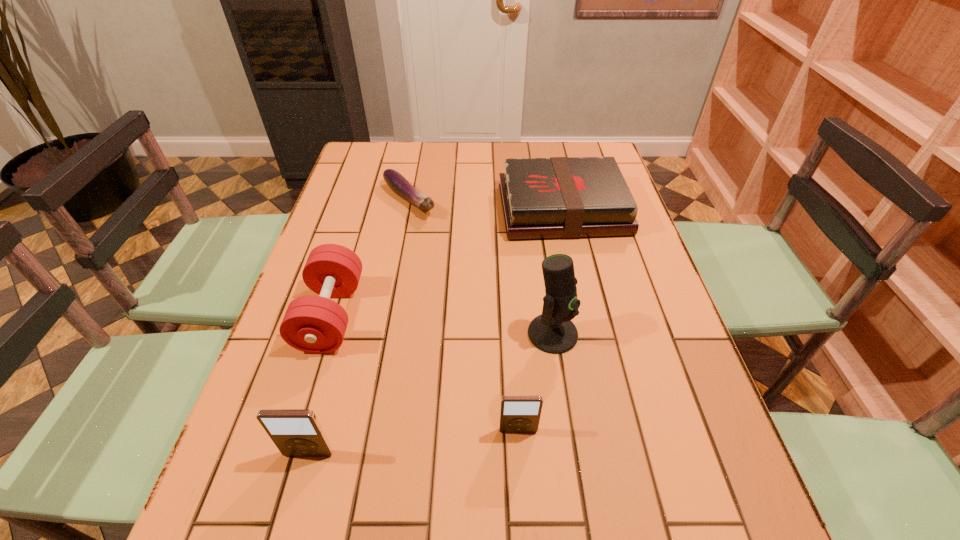
The image size is (960, 540). I want to click on free space located on the front of the eggplant, so click(x=399, y=247).

Locate an element on the screen. The width and height of the screenshot is (960, 540). vacant space located 0.060m on the back of the fifth tallest object is located at coordinates (554, 171).

Where is `vacant area situated 0.220m on the right of the dumbbell`? This screenshot has height=540, width=960. vacant area situated 0.220m on the right of the dumbbell is located at coordinates (452, 315).

Find the location of `iPod positioned at the left edge`. iPod positioned at the left edge is located at coordinates (296, 432).

Where is `eggplant situated at the left edge`? This screenshot has width=960, height=540. eggplant situated at the left edge is located at coordinates (398, 184).

Find the location of a particular element. The height and width of the screenshot is (540, 960). dumbbell that is at the left edge is located at coordinates [313, 324].

At what (x,y) coordinates should I click in order to perform the action: click on object that is at the right edge. Please return your answer as a coordinate pair (x, y). Image resolution: width=960 pixels, height=540 pixels. Looking at the image, I should click on (558, 197).

Where is `object that is at the near left corner`? object that is at the near left corner is located at coordinates (296, 432).

The image size is (960, 540). I want to click on vacant space at the far edge of the desktop, so click(x=434, y=156).

At what (x,y) coordinates should I click in order to perform the action: click on vacant region at the near edge of the desktop. Please return your answer as a coordinate pair (x, y). Looking at the image, I should click on (640, 466).